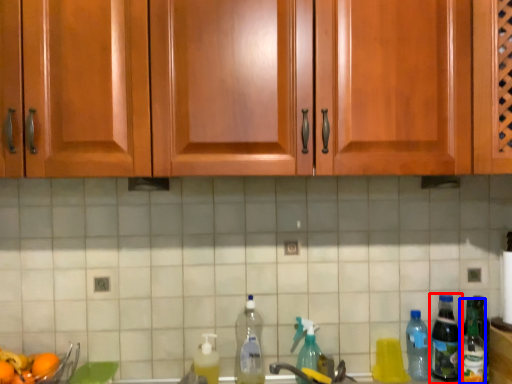
Question: Which of the following is the closest to the observer, bottle (highlighted by a red box) or bottle (highlighted by a blue box)?

Choices:
 (A) bottle
 (B) bottle

Answer: (B)